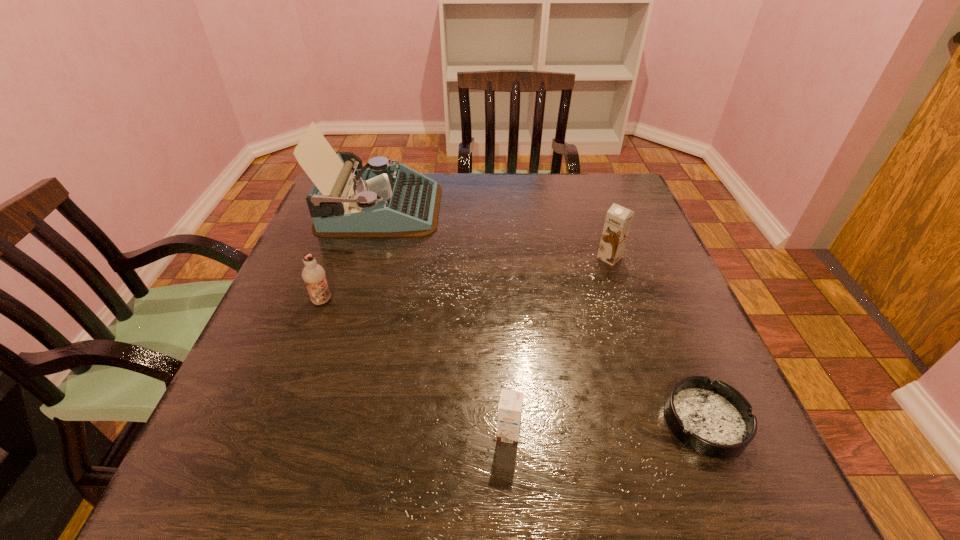
Image resolution: width=960 pixels, height=540 pixels. In order to click on blank space located on the back of the second farthest object in this screenshot , I will do `click(591, 205)`.

Locate an element on the screen. This screenshot has width=960, height=540. vacant space located 0.360m on the back of the third farthest object is located at coordinates (359, 204).

Find the location of a particular element. The width and height of the screenshot is (960, 540). vacant space located 0.100m on the back of the second chocolate milk from right to left is located at coordinates (506, 373).

The height and width of the screenshot is (540, 960). Identify the location of free space located 0.370m on the left of the shortest object. (444, 422).

Where is `object that is at the far edge`? The height and width of the screenshot is (540, 960). object that is at the far edge is located at coordinates (384, 200).

You are a GUI agent. You are given a task and a screenshot of the screen. Output one action in this format:
    pyautogui.click(x=<x>, y=<y>)
    Task: Click on the object situated at the near edge
    The height and width of the screenshot is (540, 960).
    Given the screenshot: What is the action you would take?
    pyautogui.click(x=712, y=418)

In order to click on typewriter present at the left edge in this screenshot , I will do `click(384, 200)`.

Locate an element on the screen. The image size is (960, 540). chocolate milk that is at the left edge is located at coordinates (313, 274).

Locate an element on the screen. chocolate milk located in the right edge section of the desktop is located at coordinates (618, 220).

Identify the location of ashtray that is at the right edge. (712, 418).